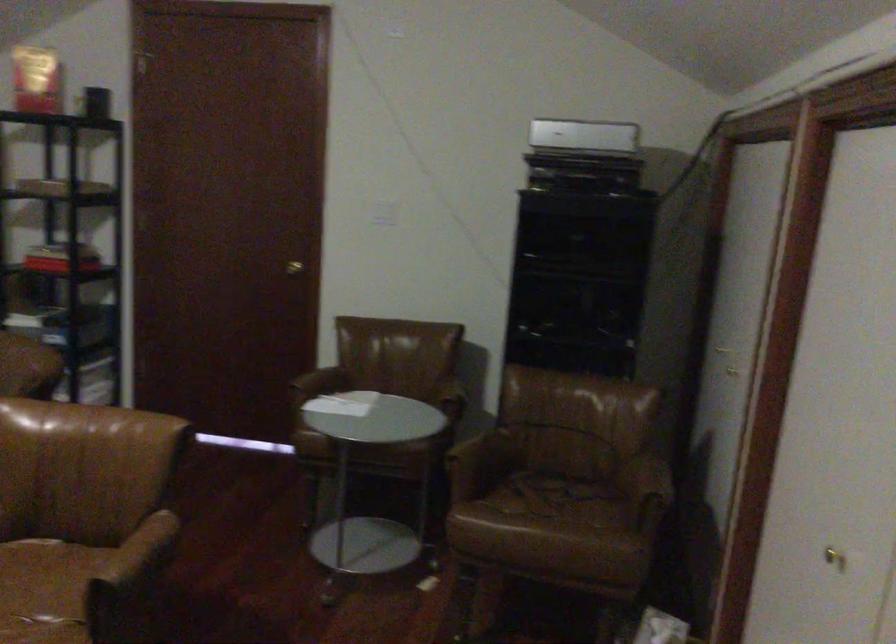
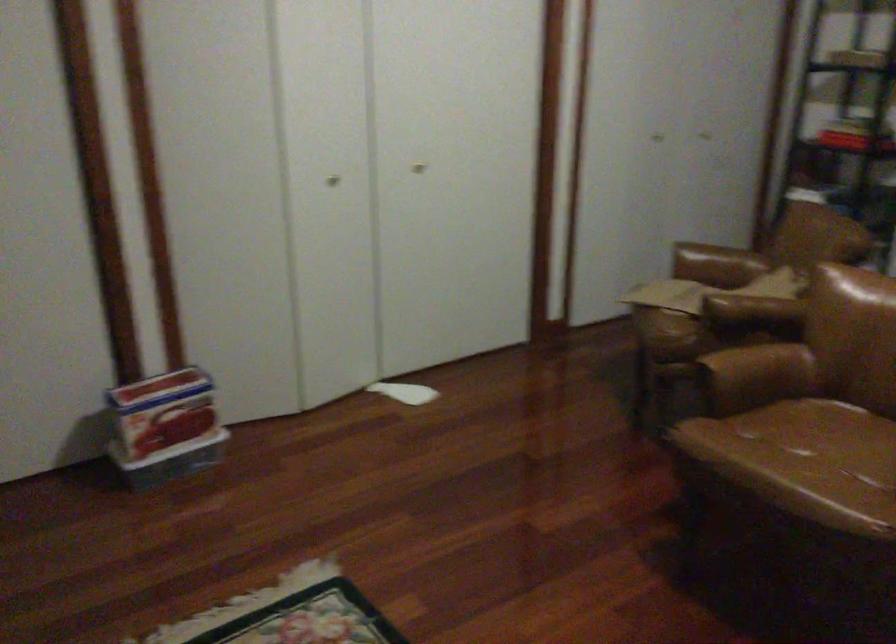
Question: The camera is either moving clockwise (left) or counter-clockwise (right) around the object. The first image is from the beginning of the video and the second image is from the end. Is the camera moving left or right when shooting the video?

Choices:
 (A) Left
 (B) Right

Answer: (B)